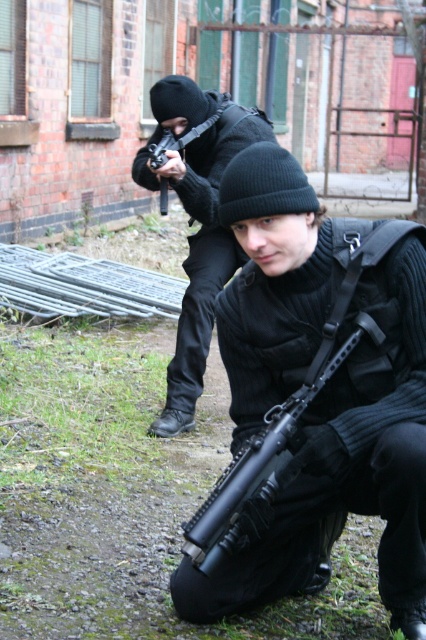
Looking at this image, does matte black rifle at center have a greater width compared to black matte rifle at center?

Correct, the width of matte black rifle at center exceeds that of black matte rifle at center.

Does matte black rifle at center have a lesser width compared to black matte rifle at center?

No, matte black rifle at center is not thinner than black matte rifle at center.

This screenshot has height=640, width=426. I want to click on matte black rifle at center, so click(x=199, y=252).

This screenshot has height=640, width=426. I want to click on matte black rifle at center, so click(x=199, y=252).